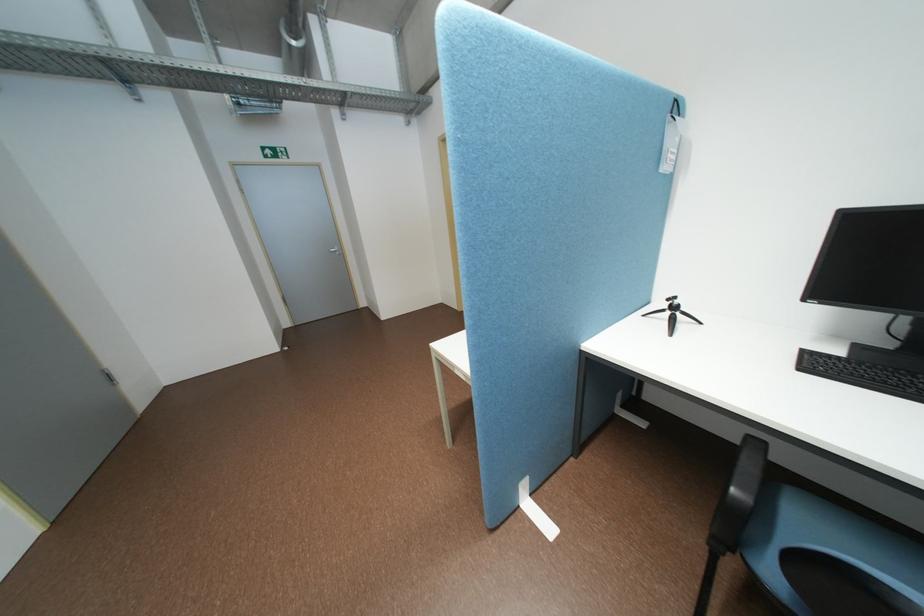
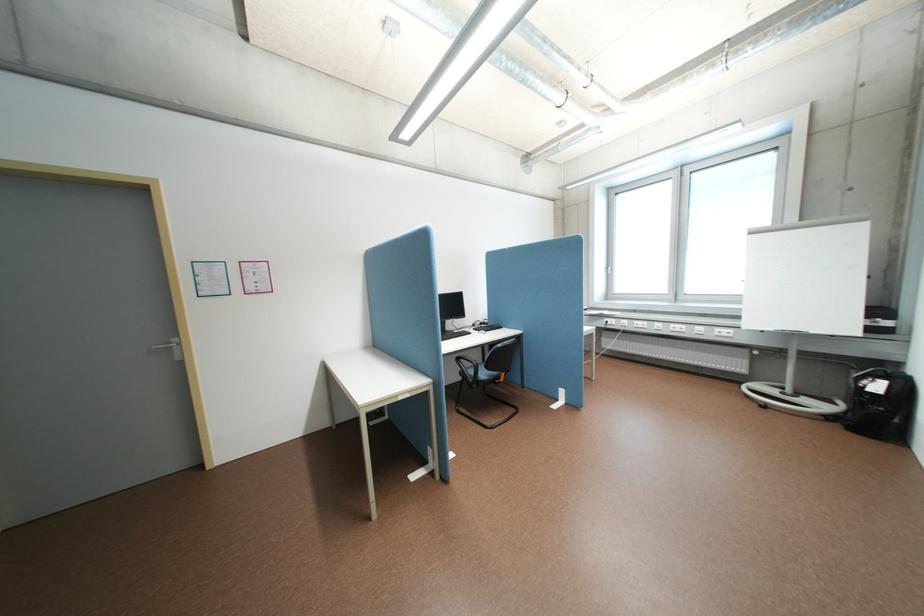
In the second image, find the point that corresponds to (x=465, y=365) in the first image.

(407, 395)